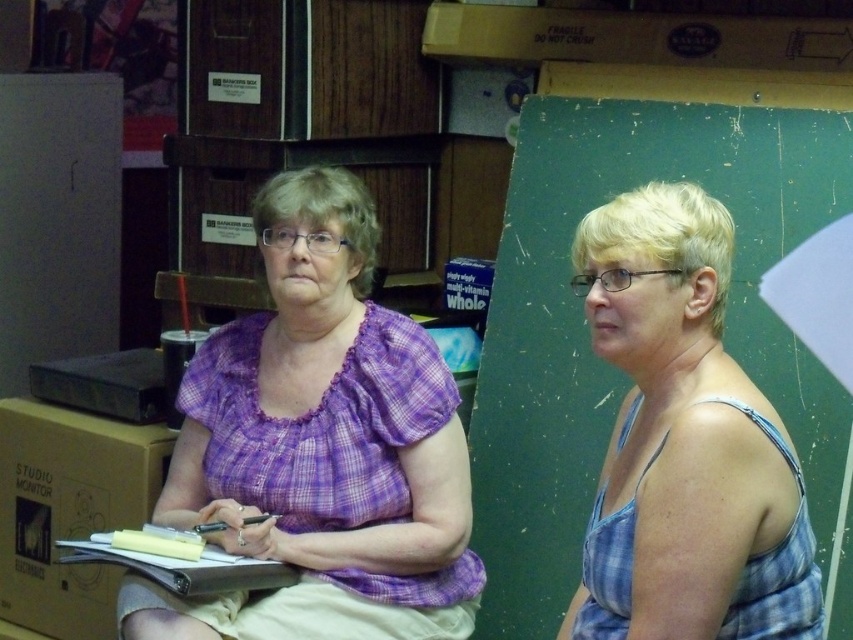
Does purple plaid blouse at center come behind blue plaid tank top at right?

Yes.

Is purple plaid blouse at center bigger than blue plaid tank top at right?

Yes, purple plaid blouse at center is bigger than blue plaid tank top at right.

Is point (347, 595) positioned after point (641, 477)?

That is True.

At what (x,y) coordinates should I click in order to perform the action: click on purple plaid blouse at center. Please return your answer as a coordinate pair (x, y). The image size is (853, 640). Looking at the image, I should click on (320, 445).

Which is in front, point (645, 625) or point (198, 577)?

Positioned in front is point (645, 625).

Identify the location of blue plaid tank top at right. (683, 442).

What are the coordinates of `blue plaid tank top at right` in the screenshot? It's located at (683, 442).

Does purple plaid blouse at center come in front of white paper at center?

No.

This screenshot has width=853, height=640. I want to click on purple plaid blouse at center, so click(x=320, y=445).

You are a GUI agent. You are given a task and a screenshot of the screen. Output one action in this format:
    pyautogui.click(x=<x>, y=<y>)
    Task: Click on the purple plaid blouse at center
    The height and width of the screenshot is (640, 853).
    Given the screenshot: What is the action you would take?
    [x=320, y=445]